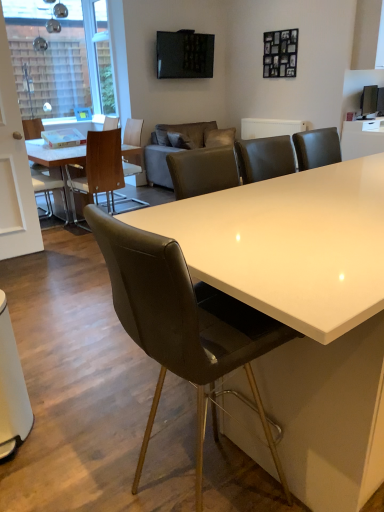
Image resolution: width=384 pixels, height=512 pixels. Find the location of `vacant location behind leather at center, placed as the fourth chair when sorted from back to front`. vacant location behind leather at center, placed as the fourth chair when sorted from back to front is located at coordinates (159, 422).